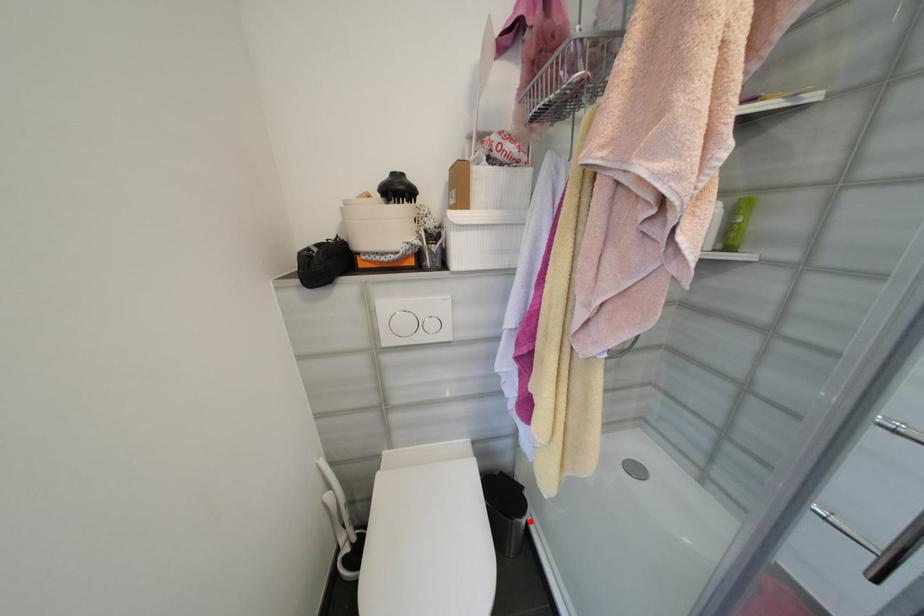
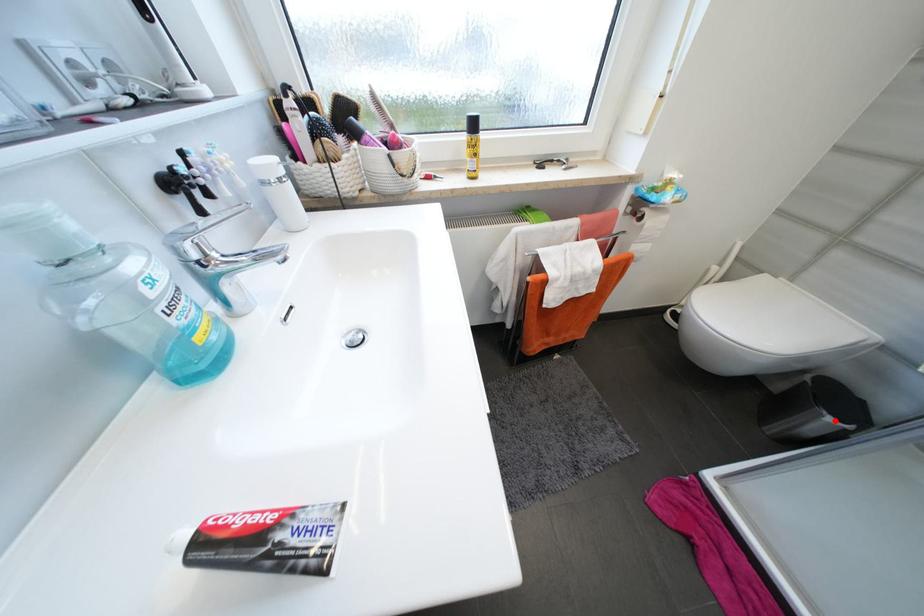
I am providing you with two images of the same scene from different viewpoints. A red point is marked on the first image and another point is marked on the second image. Do the highlighted points in image1 and image2 indicate the same real-world spot?

Yes